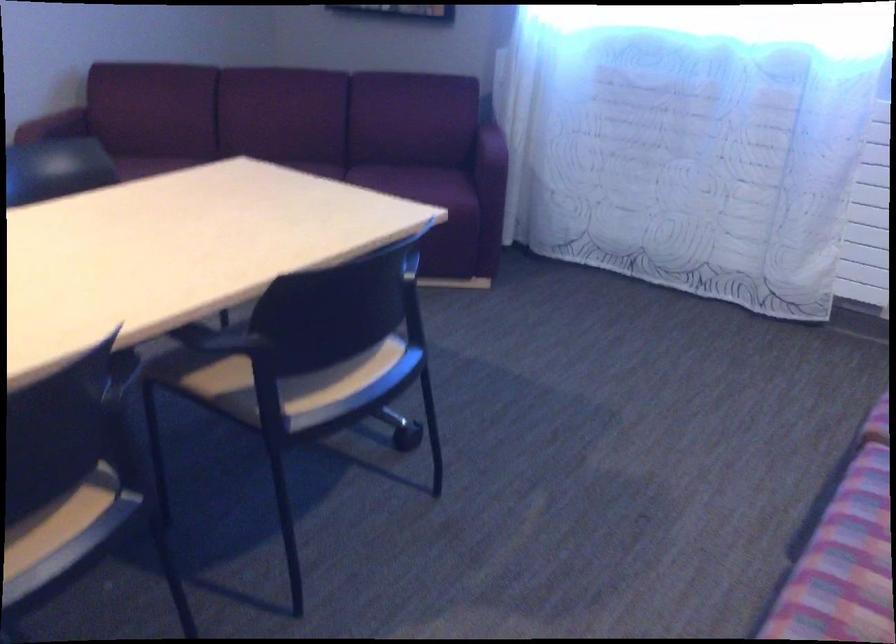
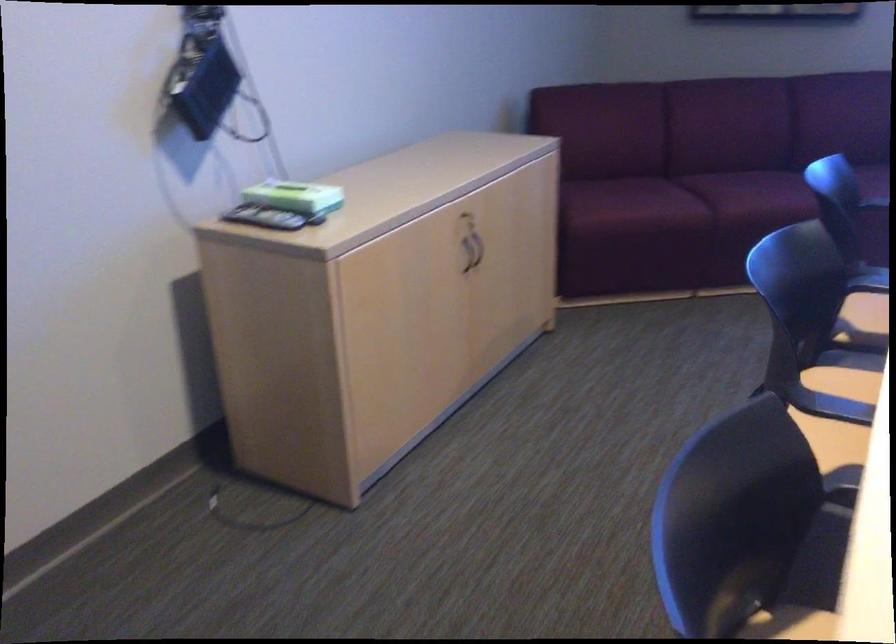
Question: What movement of the cameraman would produce the second image?

Choices:
 (A) Left
 (B) Right
 (C) Forward
 (D) Backward

Answer: (A)